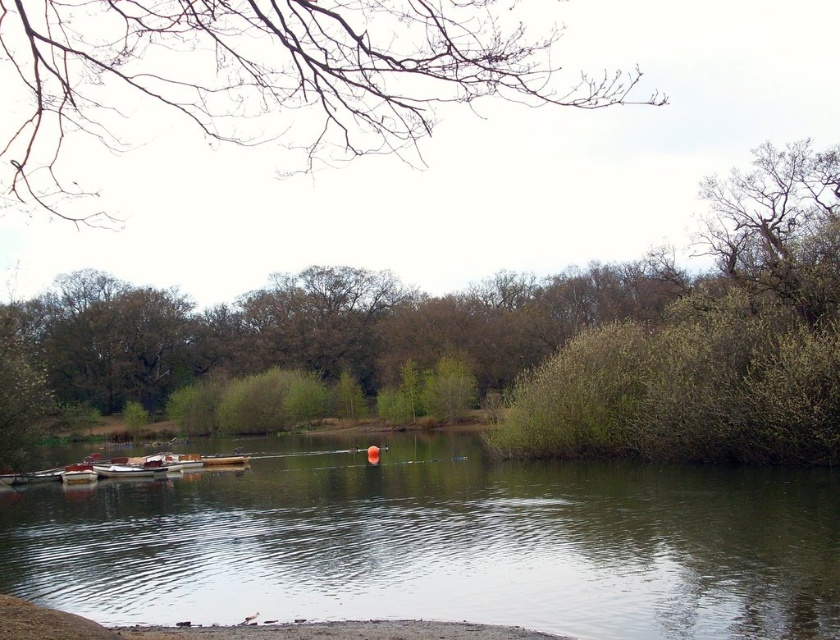
You are an artist planning to sketch the scene. You want to ensure the bare branches at upper left and the wooden boat at center are proportionally accurate. Which object should you draw wider in your sketch?

The bare branches at upper left should be drawn wider than the wooden boat at center since their width surpasses the boat according to the description.

You are an ornithologist observing birds in the serene lakeside scene. You notice a green leafy tree at center and a bare branches at upper left. Which tree would you expect to find more bird activity in, and why?

The green leafy tree at center is more likely to have bird activity because it provides cover and possibly food sources like buds or insects, whereas the bare branches at upper left lack foliage for nesting or foraging.

You are standing on the lakeside and want to walk from the wooden boat at lower left to the green reflective water at center. Which direction should you move to reach the water?

The green reflective water at center is wider than the wooden boat at lower left, so you should move towards the center of the lake to reach the water.